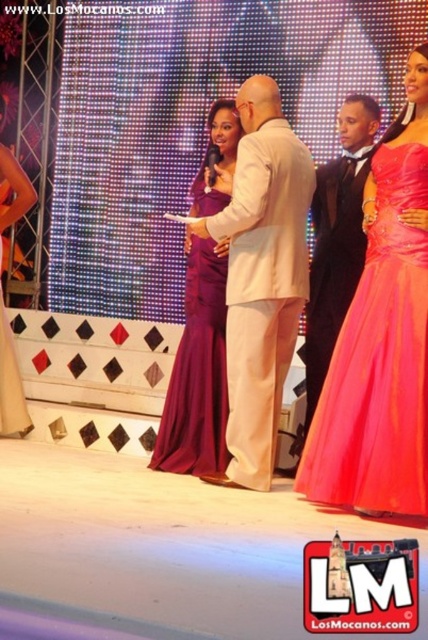
You are a photographer at the event and need to position a spotlight on the purple satin dress at center and the burgundy satin dress at center. Which dress requires a wider beam to fully illuminate?

The purple satin dress at center might require a wider beam than the burgundy satin dress at center because it is wider.

You are a stagehand carrying a 2.5 meter long banner that needs to be placed between the light beige suit at center and the matte purple dress at lower left. Can you fit the banner between them without moving either of the people?

The distance between the light beige suit at center and the matte purple dress at lower left is 2.27 meters. Since the banner is 2.5 meters long, it is longer than the available space. Therefore, the banner cannot be placed between them without moving either person.